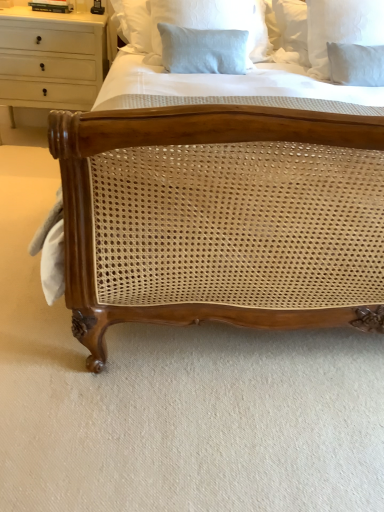
Question: Is point (64, 27) closer or farther from the camera than point (208, 23)?

Choices:
 (A) closer
 (B) farther

Answer: (B)

Question: Choose the correct answer: Is white wood chest of drawers at upper left inside light blue linen pillow at upper center, the 1th pillow from the left, or outside it?

Choices:
 (A) outside
 (B) inside

Answer: (A)

Question: Which of these objects is positioned farthest from the white wood chest of drawers at upper left?

Choices:
 (A) white linen pillow at upper right, arranged as the 2th pillow when viewed from the left
 (B) light blue linen pillow at upper center, the 1th pillow from the left

Answer: (A)

Question: Which is farther from the light blue linen pillow at upper center, arranged as the 2th pillow when viewed from the right?

Choices:
 (A) white linen pillow at upper right, which is counted as the 1th pillow, starting from the right
 (B) white wood chest of drawers at upper left

Answer: (B)